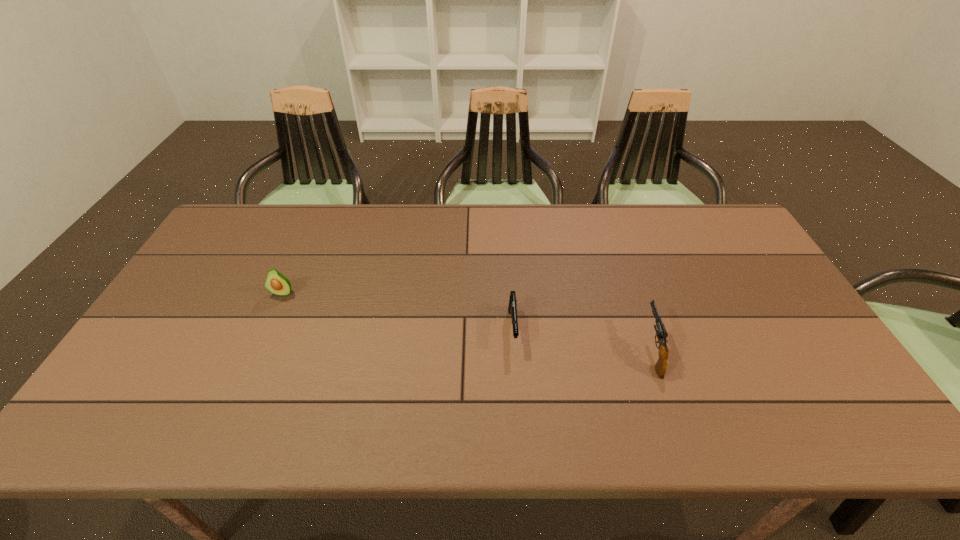
You are a GUI agent. You are given a task and a screenshot of the screen. Output one action in this format:
    pyautogui.click(x=<x>, y=<y>)
    Task: Click on the vacant space located 0.100m at the aiming end of the second object from left to right
    Image resolution: width=960 pixels, height=540 pixels.
    Given the screenshot: What is the action you would take?
    pyautogui.click(x=516, y=387)

You are a GUI agent. You are given a task and a screenshot of the screen. Output one action in this format:
    pyautogui.click(x=<x>, y=<y>)
    Task: Click on the blank space at the far edge
    The height and width of the screenshot is (540, 960).
    Given the screenshot: What is the action you would take?
    pyautogui.click(x=451, y=238)

In the image, there is a desktop. Find the location of `vacant region at the near edge`. vacant region at the near edge is located at coordinates coord(410,423).

Image resolution: width=960 pixels, height=540 pixels. In the image, there is a desktop. In order to click on vacant region at the left edge in this screenshot , I will do `click(180, 370)`.

The width and height of the screenshot is (960, 540). In order to click on free space at the right edge in this screenshot , I will do `click(833, 389)`.

Locate an element on the screen. free space at the far left corner is located at coordinates (268, 208).

The image size is (960, 540). In the image, there is a desktop. In order to click on vacant space at the far right corner in this screenshot , I will do `click(708, 221)`.

This screenshot has width=960, height=540. What are the coordinates of `vacant space in between the avocado and the right gun` in the screenshot? It's located at (468, 322).

What are the coordinates of `empty location between the leftmost object and the left gun` in the screenshot? It's located at (397, 310).

Locate an element on the screen. The height and width of the screenshot is (540, 960). empty space that is in between the right gun and the second object from right to left is located at coordinates (582, 340).